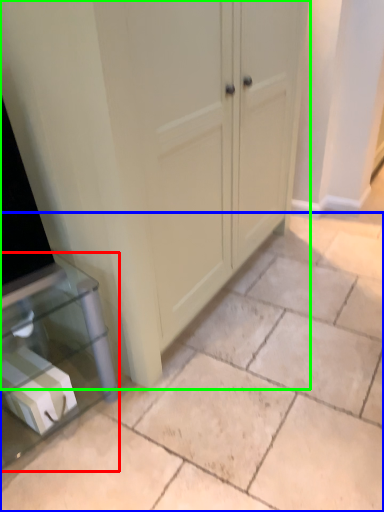
Question: Based on their relative distances, which object is farther from furniture (highlighted by a red box)? Choose from concrete (highlighted by a blue box) and cupboard (highlighted by a green box).

Choices:
 (A) concrete
 (B) cupboard

Answer: (B)